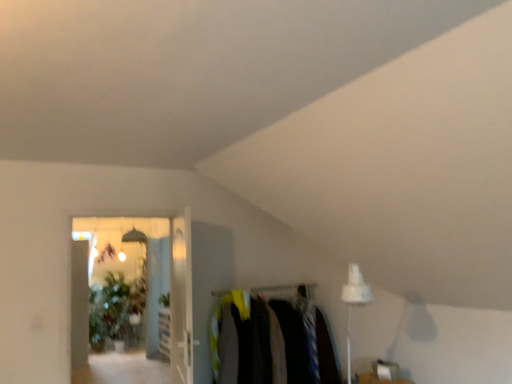
Question: Is transparent glass door at center, acting as the first glass door starting from the left, completely or partially inside clear glass door at center, the second glass door from the left?

Choices:
 (A) yes
 (B) no

Answer: (B)

Question: From a real-world perspective, is clear glass door at center, the second glass door from the left, beneath transparent glass door at center, acting as the 2th glass door starting from the right?

Choices:
 (A) yes
 (B) no

Answer: (A)

Question: Is clear glass door at center, the second glass door from the left, at the right side of transparent glass door at center, acting as the 2th glass door starting from the right?

Choices:
 (A) no
 (B) yes

Answer: (B)

Question: Considering the relative sizes of clear glass door at center, which ranks as the first glass door in right-to-left order, and transparent glass door at center, acting as the first glass door starting from the left, in the image provided, is clear glass door at center, which ranks as the first glass door in right-to-left order, smaller than transparent glass door at center, acting as the first glass door starting from the left,?

Choices:
 (A) yes
 (B) no

Answer: (A)

Question: Is clear glass door at center, which ranks as the first glass door in right-to-left order, at the left side of transparent glass door at center, acting as the first glass door starting from the left?

Choices:
 (A) no
 (B) yes

Answer: (A)

Question: In terms of width, does clear glass door at center, the second glass door from the left, look wider or thinner when compared to green leafy plant at upper center?

Choices:
 (A) thin
 (B) wide

Answer: (A)

Question: Is clear glass door at center, which ranks as the first glass door in right-to-left order, inside the boundaries of green leafy plant at upper center, or outside?

Choices:
 (A) inside
 (B) outside

Answer: (B)

Question: From their relative heights in the image, would you say clear glass door at center, the second glass door from the left, is taller or shorter than green leafy plant at upper center?

Choices:
 (A) short
 (B) tall

Answer: (B)

Question: Considering their positions, is clear glass door at center, the second glass door from the left, located in front of or behind green leafy plant at upper center?

Choices:
 (A) front
 (B) behind

Answer: (A)

Question: Is clear glass door at center, the second glass door from the left, to the left or to the right of dark fabric clothes at center in the image?

Choices:
 (A) left
 (B) right

Answer: (A)

Question: Does point (188, 350) appear closer or farther from the camera than point (271, 345)?

Choices:
 (A) farther
 (B) closer

Answer: (B)

Question: In terms of height, does clear glass door at center, which ranks as the first glass door in right-to-left order, look taller or shorter compared to dark fabric clothes at center?

Choices:
 (A) short
 (B) tall

Answer: (B)

Question: From a real-world perspective, relative to dark fabric clothes at center, is clear glass door at center, which ranks as the first glass door in right-to-left order, vertically above or below?

Choices:
 (A) above
 (B) below

Answer: (A)

Question: Considering the positions of point (114, 269) and point (304, 306), is point (114, 269) closer or farther from the camera than point (304, 306)?

Choices:
 (A) farther
 (B) closer

Answer: (A)

Question: From the image's perspective, relative to dark fabric clothes at center, is transparent glass door at center, acting as the first glass door starting from the left, above or below?

Choices:
 (A) below
 (B) above

Answer: (B)